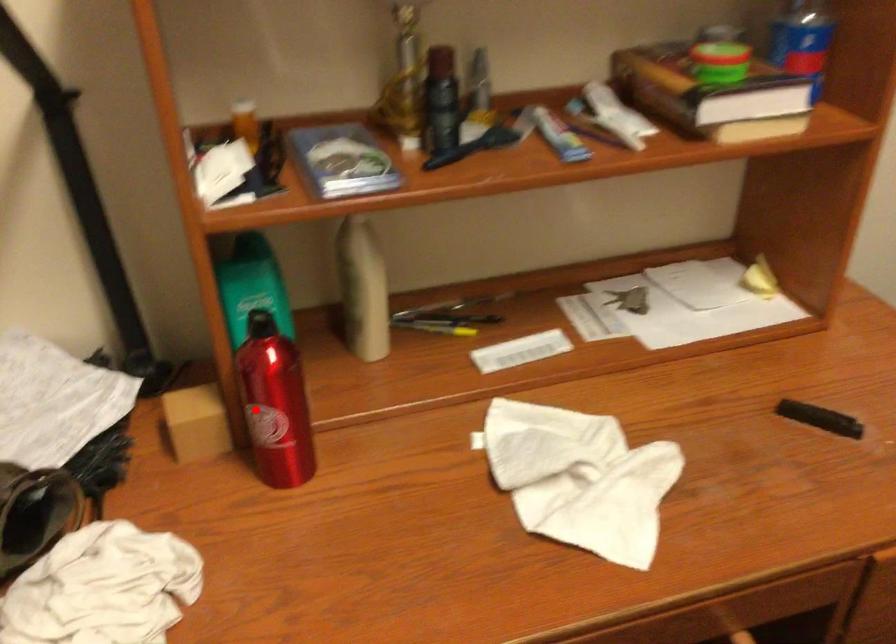
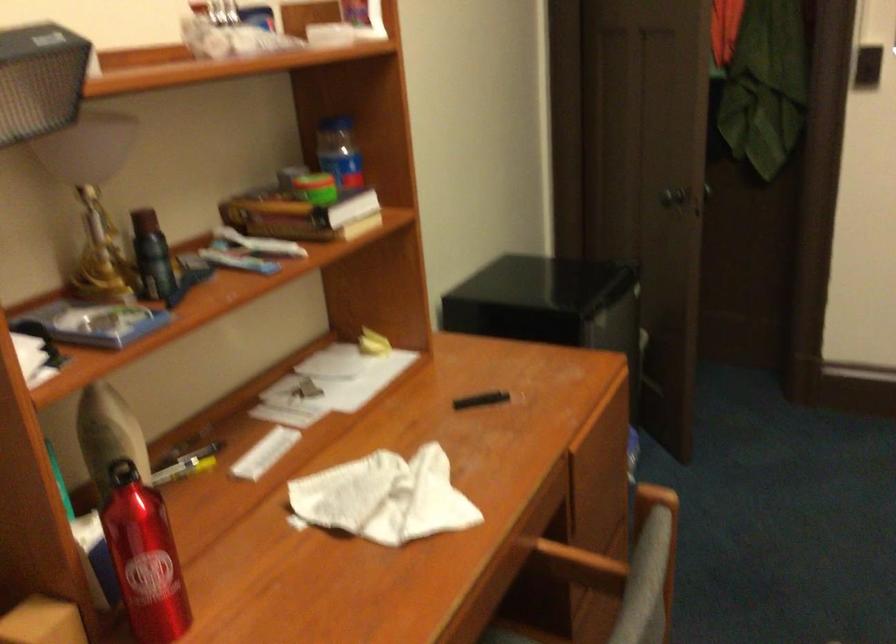
The point at the highlighted location is marked in the first image. Where is the corresponding point in the second image?

(143, 558)